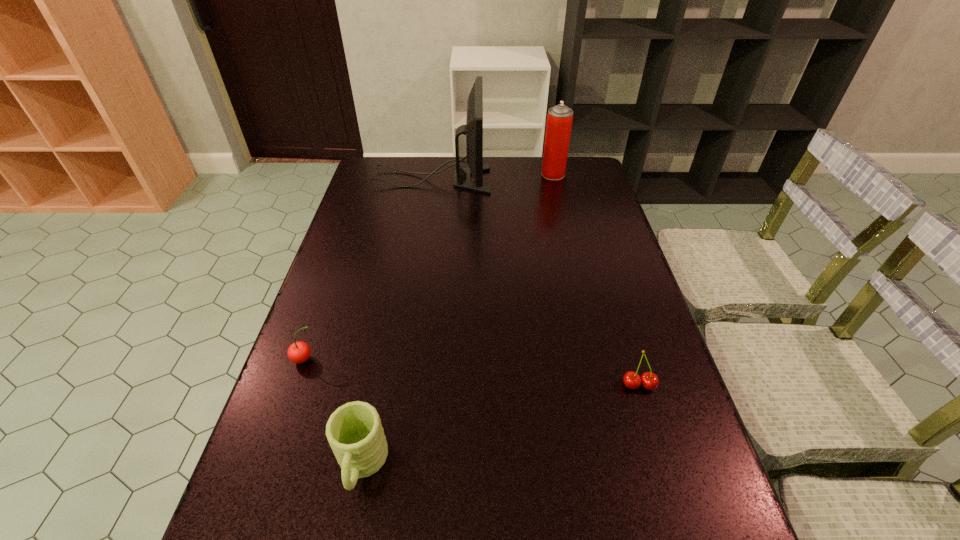
I want to click on computer monitor, so click(473, 129).

Where is `aerosol can`? aerosol can is located at coordinates (559, 119).

Find the location of a particular element. The width and height of the screenshot is (960, 540). mug is located at coordinates (354, 431).

Where is `the third nearest object`? Image resolution: width=960 pixels, height=540 pixels. the third nearest object is located at coordinates (299, 352).

At what (x,y) coordinates should I click in order to perform the action: click on the farther cherry. Please return your answer as a coordinate pair (x, y). Looking at the image, I should click on (299, 352).

You are a GUI agent. You are given a task and a screenshot of the screen. Output one action in this format:
    pyautogui.click(x=<x>, y=<y>)
    Task: Click on the second nearest object
    
    Given the screenshot: What is the action you would take?
    pyautogui.click(x=649, y=380)

This screenshot has width=960, height=540. In order to click on the right cherry in this screenshot , I will do `click(649, 380)`.

The width and height of the screenshot is (960, 540). What are the coordinates of `vacant region located on the screen side of the computer monitor` in the screenshot? It's located at (543, 180).

This screenshot has height=540, width=960. Find the location of `vacant space located 0.240m on the left of the aerosol can`. vacant space located 0.240m on the left of the aerosol can is located at coordinates (478, 174).

Locate an element on the screen. The height and width of the screenshot is (540, 960). blank space located 0.190m on the back of the left cherry is located at coordinates (327, 295).